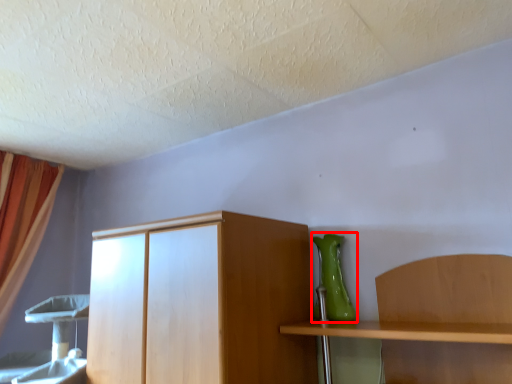
Question: From the image, what is the correct spatial relationship of vase (annotated by the red box) in relation to curtain?

Choices:
 (A) left
 (B) right

Answer: (B)